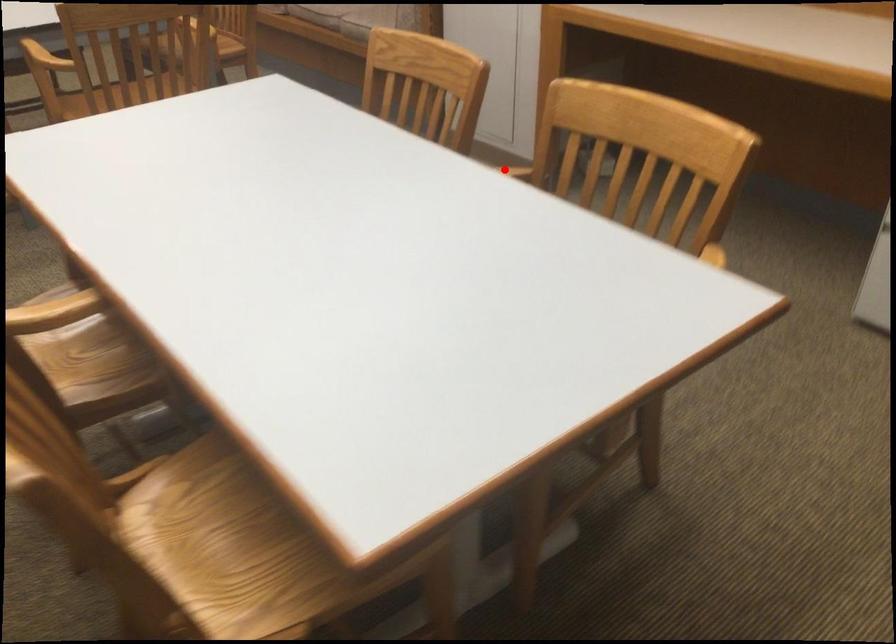
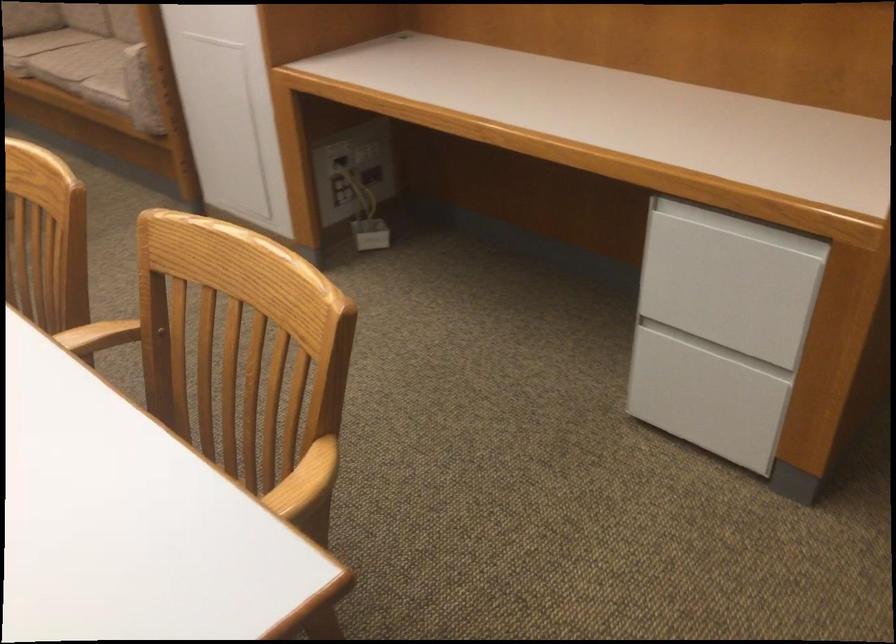
Find the pixel in the second image that matches the highlighted location in the first image.

(104, 335)